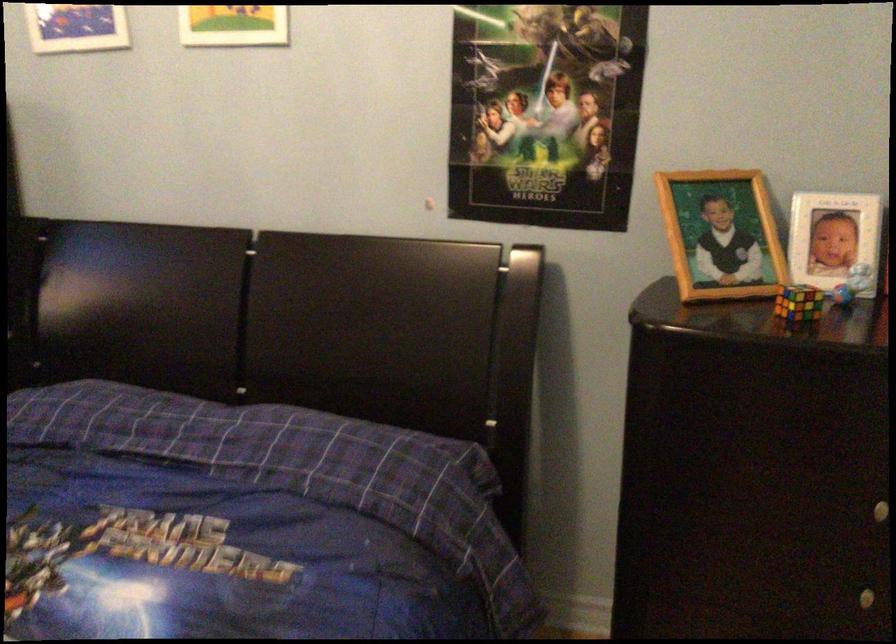
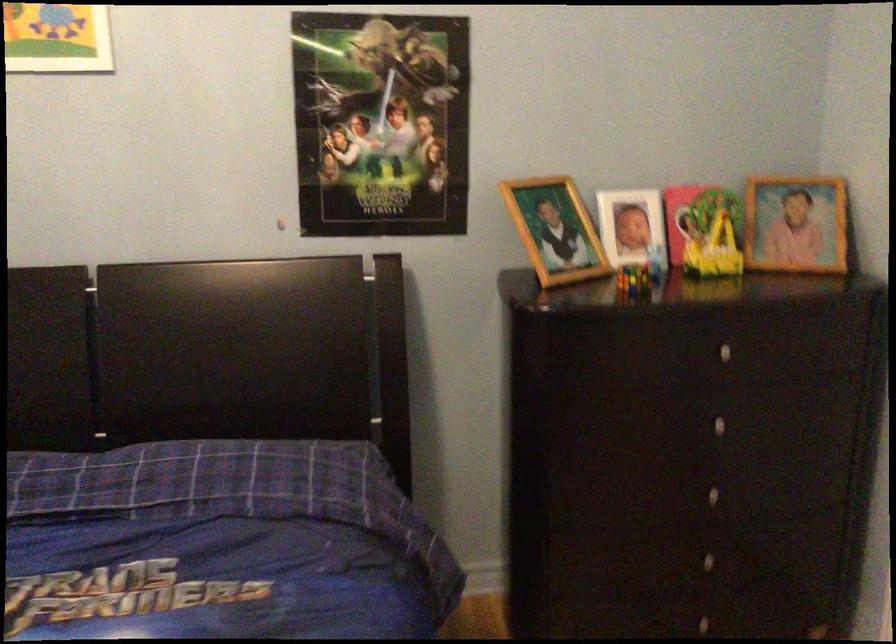
Where in the second image is the point corresponding to (x=798, y=312) from the first image?

(634, 279)